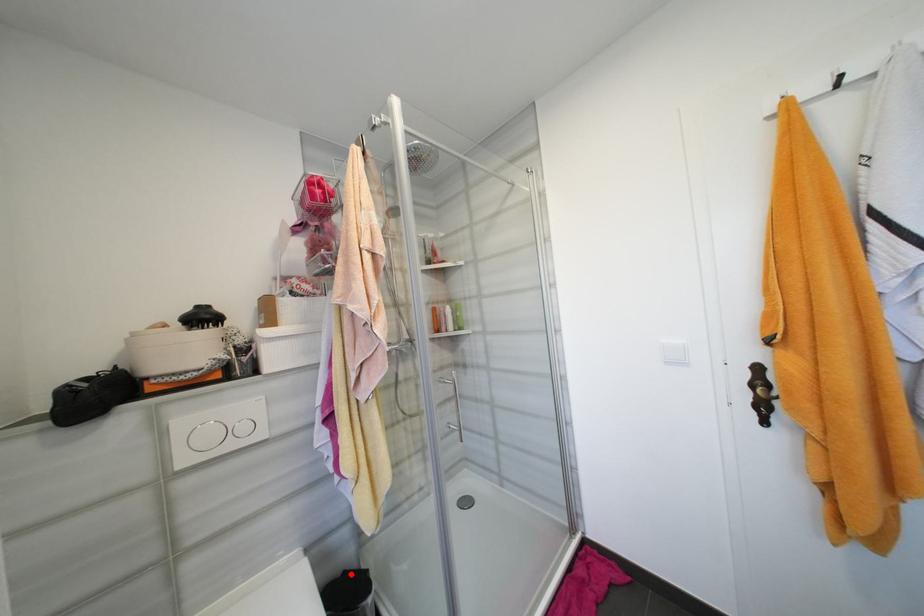
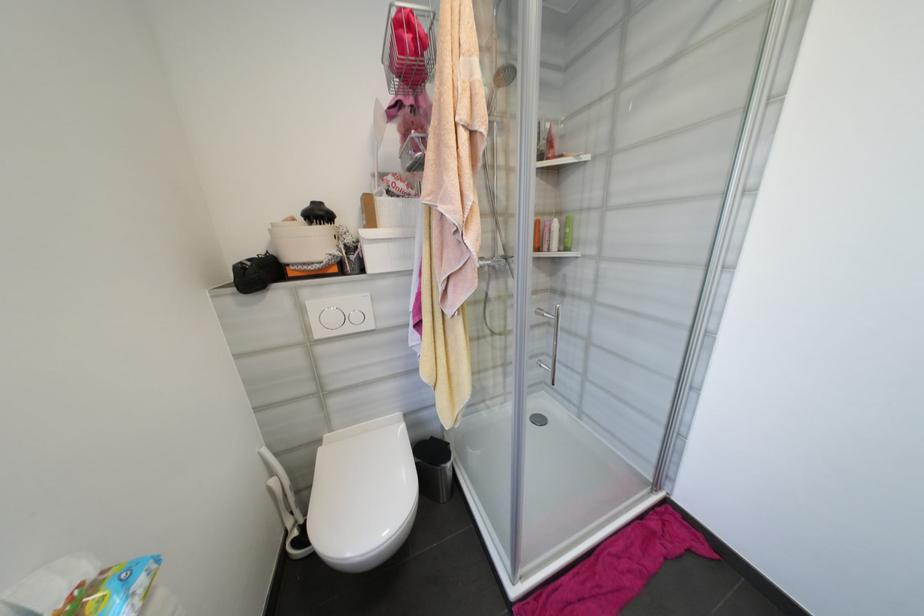
Question: I am providing you with two images of the same scene from different viewpoints. A red point is shown in image1. For the corresponding object point in image2, is it positioned nearer or farther from the camera?

Choices:
 (A) Nearer
 (B) Farther

Answer: (B)